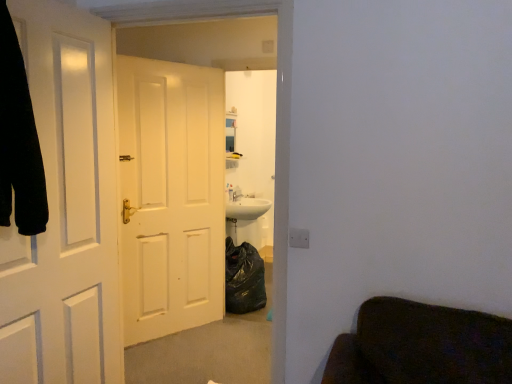
Locate an element on the screen. black fabric robe at left is located at coordinates (19, 140).

I want to click on white matte door at center, positioned as the 1th door in back-to-front order, so click(170, 195).

In the scene shown: Is black fabric robe at left turned away from white matte door at center, positioned as the 1th door in back-to-front order?

black fabric robe at left is not turned away from white matte door at center, positioned as the 1th door in back-to-front order.

Identify the location of robe located on the left of white matte door at center, which is the 2th door in front-to-back order. This screenshot has width=512, height=384. (19, 140).

In the scene shown: Looking at the image, does black fabric robe at left seem bigger or smaller compared to white matte door at center, positioned as the 1th door in back-to-front order?

In the image, black fabric robe at left appears to be smaller than white matte door at center, positioned as the 1th door in back-to-front order.

Is point (9, 210) positioned before point (130, 81)?

That is True.

Is white matte door at left, the 1th door positioned from the front, positioned with its back to white matte door at center, positioned as the 1th door in back-to-front order?

A: white matte door at left, the 1th door positioned from the front, does not have its back to white matte door at center, positioned as the 1th door in back-to-front order.

From the image's perspective, which object appears higher, white matte door at left, the 1th door positioned from the front, or white matte door at center, which is the 2th door in front-to-back order?

From the image's view, white matte door at center, which is the 2th door in front-to-back order, is above.

How different are the orientations of white matte door at left, the 1th door positioned from the front, and white matte door at center, which is the 2th door in front-to-back order, in degrees?

29.9 degrees.

Is white matte door at left, arranged as the 2th door when viewed from the back, wider or thinner than white matte door at center, which is the 2th door in front-to-back order?

Clearly, white matte door at left, arranged as the 2th door when viewed from the back, has less width compared to white matte door at center, which is the 2th door in front-to-back order.

How distant is white matte door at center, which is the 2th door in front-to-back order, from white matte door at left, the 1th door positioned from the front?

A distance of 3.30 feet exists between white matte door at center, which is the 2th door in front-to-back order, and white matte door at left, the 1th door positioned from the front.

Considering the sizes of objects white matte door at center, positioned as the 1th door in back-to-front order, and white matte door at left, arranged as the 2th door when viewed from the back, in the image provided, who is wider, white matte door at center, positioned as the 1th door in back-to-front order, or white matte door at left, arranged as the 2th door when viewed from the back,?

white matte door at center, positioned as the 1th door in back-to-front order.

The height and width of the screenshot is (384, 512). I want to click on door in front of the white matte door at center, which is the 2th door in front-to-back order, so click(x=66, y=209).

Is there a large distance between white matte door at center, positioned as the 1th door in back-to-front order, and white matte door at left, arranged as the 2th door when viewed from the back?

Yes.

What's the angular difference between white matte door at center, which is the 2th door in front-to-back order, and black fabric robe at left's facing directions?

There is a 40-degree angle between the facing directions of white matte door at center, which is the 2th door in front-to-back order, and black fabric robe at left.

From the image's perspective, is white matte door at center, positioned as the 1th door in back-to-front order, positioned above or below black fabric robe at left?

white matte door at center, positioned as the 1th door in back-to-front order, is below black fabric robe at left.

In the scene shown: Which is farther, (198, 105) or (3, 146)?

The point (198, 105) is behind.

Can you confirm if white matte door at center, positioned as the 1th door in back-to-front order, is wider than black fabric robe at left?

No.

From a real-world perspective, is white matte door at left, arranged as the 2th door when viewed from the back, above or below black fabric robe at left?

In terms of real-world spatial position, white matte door at left, arranged as the 2th door when viewed from the back, is below black fabric robe at left.

Does white matte door at left, arranged as the 2th door when viewed from the back, appear on the left side of black fabric robe at left?

No.

Is white matte door at left, the 1th door positioned from the front, not within black fabric robe at left?

Yes.

From the picture: Can you see white matte door at left, the 1th door positioned from the front, touching black fabric robe at left?

No, white matte door at left, the 1th door positioned from the front, is not touching black fabric robe at left.

How many degrees apart are the facing directions of black fabric robe at left and white matte door at left, arranged as the 2th door when viewed from the back?

10.1 degrees separate the facing orientations of black fabric robe at left and white matte door at left, arranged as the 2th door when viewed from the back.

From a real-world perspective, is black fabric robe at left located higher than white matte door at left, the 1th door positioned from the front?

Yes, from a real-world perspective, black fabric robe at left is on top of white matte door at left, the 1th door positioned from the front.

Is white matte door at left, arranged as the 2th door when viewed from the back, at the back of black fabric robe at left?

Yes, white matte door at left, arranged as the 2th door when viewed from the back, is at the back of black fabric robe at left.

Does black fabric robe at left contain white matte door at left, the 1th door positioned from the front?

No, white matte door at left, the 1th door positioned from the front, is not a part of black fabric robe at left.

From the image's perspective, starting from the black fabric robe at left, which door is the 1st one below? Please provide its 2D coordinates.

[(170, 195)]

This screenshot has height=384, width=512. Identify the location of door in front of the white matte door at center, which is the 2th door in front-to-back order. (66, 209).

From the image, which object appears to be nearer to black fabric robe at left, white matte door at center, which is the 2th door in front-to-back order, or white matte door at left, arranged as the 2th door when viewed from the back?

Based on the image, white matte door at left, arranged as the 2th door when viewed from the back, appears to be nearer to black fabric robe at left.

When comparing their distances from white matte door at left, the 1th door positioned from the front, does white matte door at center, positioned as the 1th door in back-to-front order, or black fabric robe at left seem further?

white matte door at center, positioned as the 1th door in back-to-front order.

Estimate the real-world distances between objects in this image. Which object is further from white matte door at center, positioned as the 1th door in back-to-front order, black fabric robe at left or white matte door at left, the 1th door positioned from the front?

Among the two, black fabric robe at left is located further to white matte door at center, positioned as the 1th door in back-to-front order.

Consider the image. Looking at the image, which one is located closer to white matte door at left, the 1th door positioned from the front, black fabric robe at left or white matte door at center, positioned as the 1th door in back-to-front order?

The object closer to white matte door at left, the 1th door positioned from the front, is black fabric robe at left.

Estimate the real-world distances between objects in this image. Which object is closer to white matte door at center, positioned as the 1th door in back-to-front order, white matte door at left, arranged as the 2th door when viewed from the back, or black fabric robe at left?

white matte door at left, arranged as the 2th door when viewed from the back.

Which object lies further to the anchor point black fabric robe at left, white matte door at left, the 1th door positioned from the front, or white matte door at center, which is the 2th door in front-to-back order?

Based on the image, white matte door at center, which is the 2th door in front-to-back order, appears to be further to black fabric robe at left.

Where is `door between black fabric robe at left and white matte door at center, positioned as the 1th door in back-to-front order, along the z-axis`? The height and width of the screenshot is (384, 512). door between black fabric robe at left and white matte door at center, positioned as the 1th door in back-to-front order, along the z-axis is located at coordinates (66, 209).